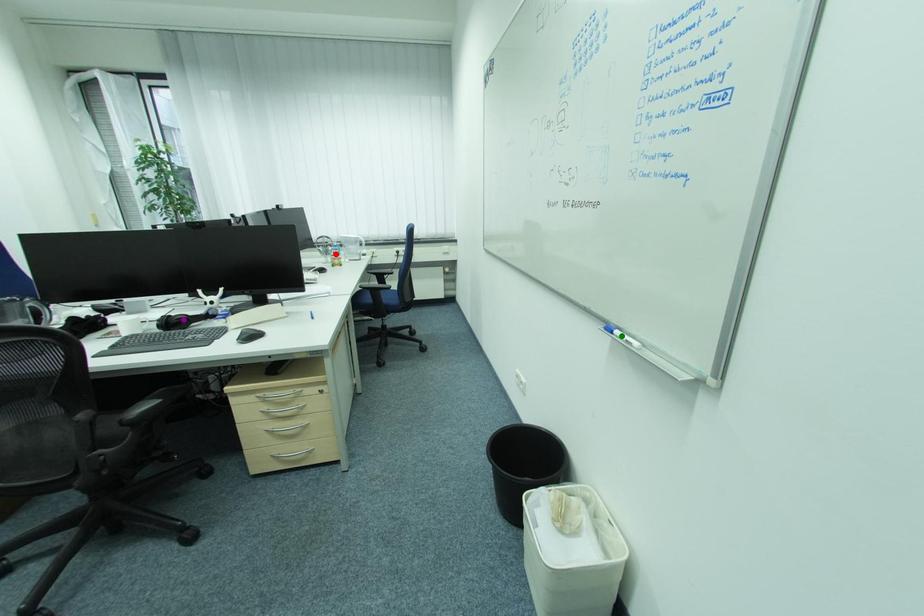
Order these from nearest to farthest:
- purple point
- green point
- red point

1. red point
2. purple point
3. green point